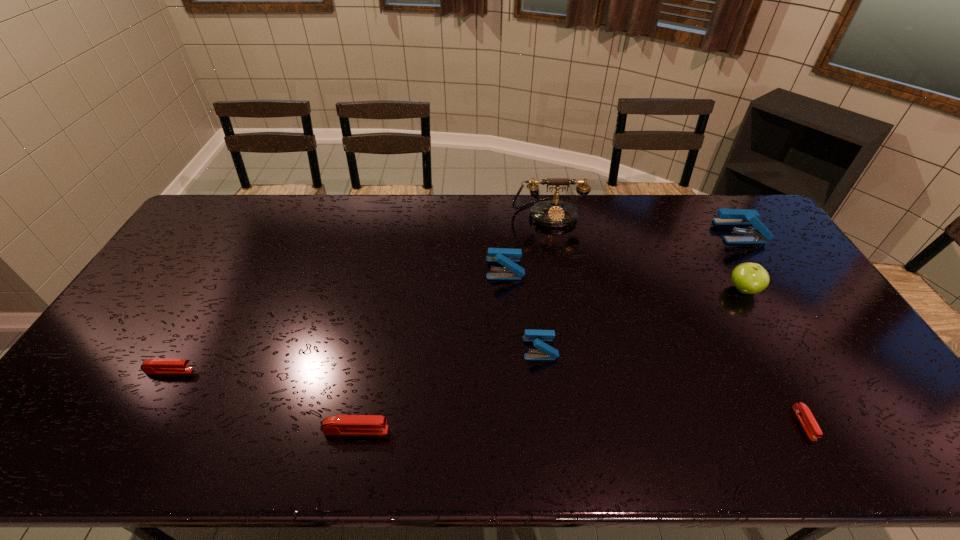
I want to click on vacant space located 0.210m on the front-facing side of the biggest red stapler, so point(477,430).

Identify the location of free region located 0.270m on the front-facing side of the second shortest object. (296, 371).

Locate an element on the screen. This screenshot has height=540, width=960. free space located on the front-facing side of the shortest stapler is located at coordinates (827, 463).

Identify the location of telephone positioned at the far edge. Image resolution: width=960 pixels, height=540 pixels. (555, 213).

The width and height of the screenshot is (960, 540). What are the coordinates of `stapler that is at the far edge` in the screenshot? It's located at (726, 216).

Where is `object that is positioned at the left edge`? This screenshot has width=960, height=540. object that is positioned at the left edge is located at coordinates (151, 366).

The image size is (960, 540). Find the location of `object that is positioned at the right edge`. object that is positioned at the right edge is located at coordinates 726,216.

Image resolution: width=960 pixels, height=540 pixels. In order to click on object that is at the far right corner in this screenshot , I will do `click(726, 216)`.

The height and width of the screenshot is (540, 960). In the image, there is a desktop. What are the coordinates of `vacant space at the far edge` in the screenshot? It's located at (383, 199).

I want to click on vacant region at the near edge of the desktop, so click(117, 427).